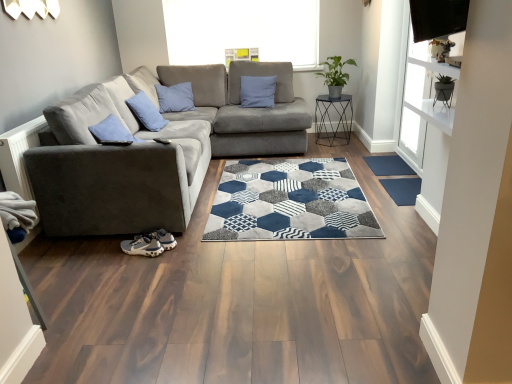
Question: Is transparent glass window screen at upper right outside of green matte plant at upper right?

Choices:
 (A) yes
 (B) no

Answer: (A)

Question: From a real-world perspective, is transparent glass window screen at upper right located higher than green matte plant at upper right?

Choices:
 (A) no
 (B) yes

Answer: (A)

Question: Does transparent glass window screen at upper right have a greater height compared to green matte plant at upper right?

Choices:
 (A) no
 (B) yes

Answer: (B)

Question: Can you confirm if transparent glass window screen at upper right is wider than green matte plant at upper right?

Choices:
 (A) no
 (B) yes

Answer: (A)

Question: Is transparent glass window screen at upper right in contact with green matte plant at upper right?

Choices:
 (A) yes
 (B) no

Answer: (B)

Question: Does transparent glass window screen at upper right turn towards green matte plant at upper right?

Choices:
 (A) yes
 (B) no

Answer: (B)

Question: Considering the relative sizes of metallic black side table at center and dark blue rubber mat at lower right, marked as the first doormat in a back-to-front arrangement, in the image provided, is metallic black side table at center wider than dark blue rubber mat at lower right, marked as the first doormat in a back-to-front arrangement,?

Choices:
 (A) no
 (B) yes

Answer: (B)

Question: Is metallic black side table at center facing towards dark blue rubber mat at lower right, which ranks as the 2th doormat in front-to-back order?

Choices:
 (A) no
 (B) yes

Answer: (B)

Question: Is metallic black side table at center turned away from dark blue rubber mat at lower right, which ranks as the 2th doormat in front-to-back order?

Choices:
 (A) no
 (B) yes

Answer: (A)

Question: From the image's perspective, would you say metallic black side table at center is positioned over dark blue rubber mat at lower right, placed as the 2th doormat when sorted from bottom to top?

Choices:
 (A) no
 (B) yes

Answer: (B)

Question: Is metallic black side table at center in contact with dark blue rubber mat at lower right, marked as the first doormat in a back-to-front arrangement?

Choices:
 (A) no
 (B) yes

Answer: (A)

Question: Is metallic black side table at center to the right of dark blue rubber mat at lower right, which ranks as the 2th doormat in front-to-back order, from the viewer's perspective?

Choices:
 (A) yes
 (B) no

Answer: (B)

Question: Can dark blue rubber mat at lower right, placed as the 2th doormat when sorted from bottom to top, be found inside velvet grey couch at center?

Choices:
 (A) no
 (B) yes

Answer: (A)